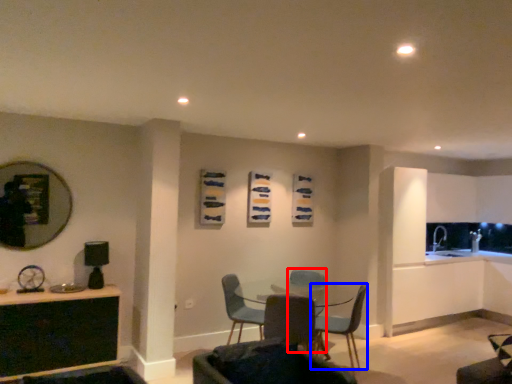
Question: Which object is closer to the camera taking this photo, armchair (highlighted by a red box) or chair (highlighted by a blue box)?

Choices:
 (A) armchair
 (B) chair

Answer: (B)